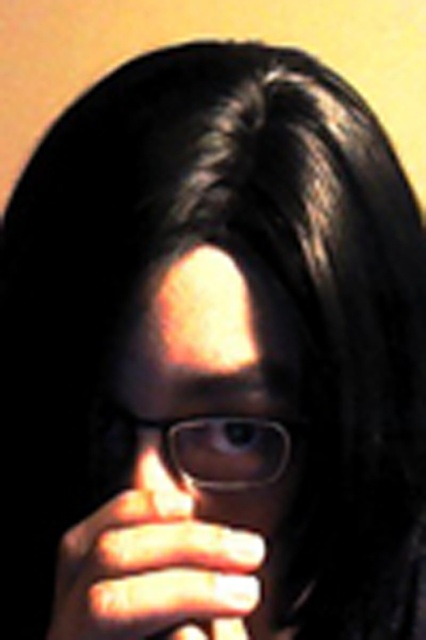
Which is in front, point (258, 484) or point (141, 481)?

Point (141, 481) is more forward.

Looking at this image, which is more to the left, transparent plastic glasses at center or translucent glass nose at center?

Positioned to the left is translucent glass nose at center.

Describe the element at coordinates (203, 448) in the screenshot. I see `transparent plastic glasses at center` at that location.

Image resolution: width=426 pixels, height=640 pixels. In order to click on transparent plastic glasses at center in this screenshot , I will do `click(203, 448)`.

Measure the distance between matte black glasses at center and translucent glass nose at center.

matte black glasses at center is 1.41 inches from translucent glass nose at center.

Between point (229, 346) and point (180, 480), which one is positioned in front?

Positioned in front is point (229, 346).

Where is `matte black glasses at center`? The width and height of the screenshot is (426, 640). matte black glasses at center is located at coordinates (219, 403).

Does satin white hand at center have a lesser width compared to translucent glass nose at center?

Incorrect, satin white hand at center's width is not less than translucent glass nose at center's.

Locate an element on the screen. satin white hand at center is located at coordinates (152, 572).